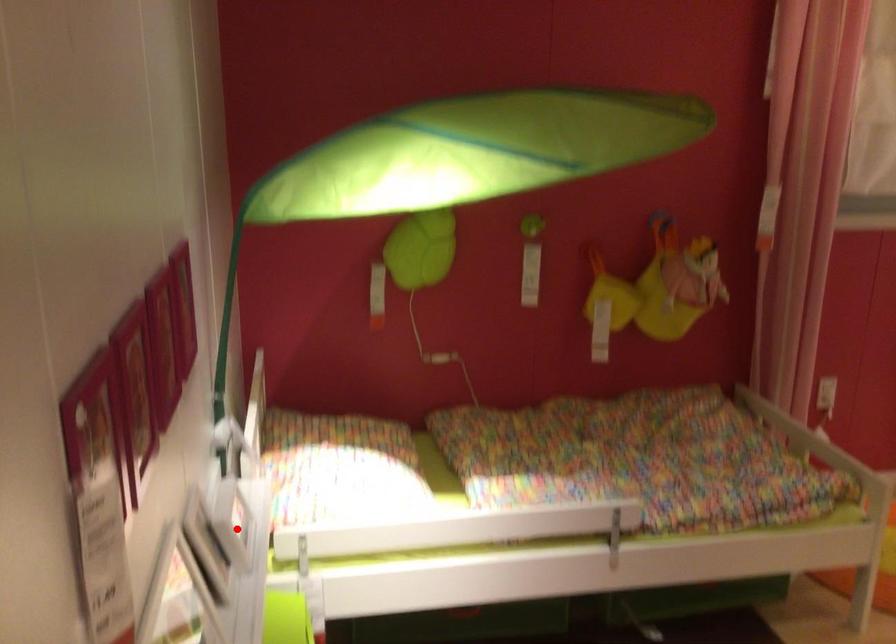
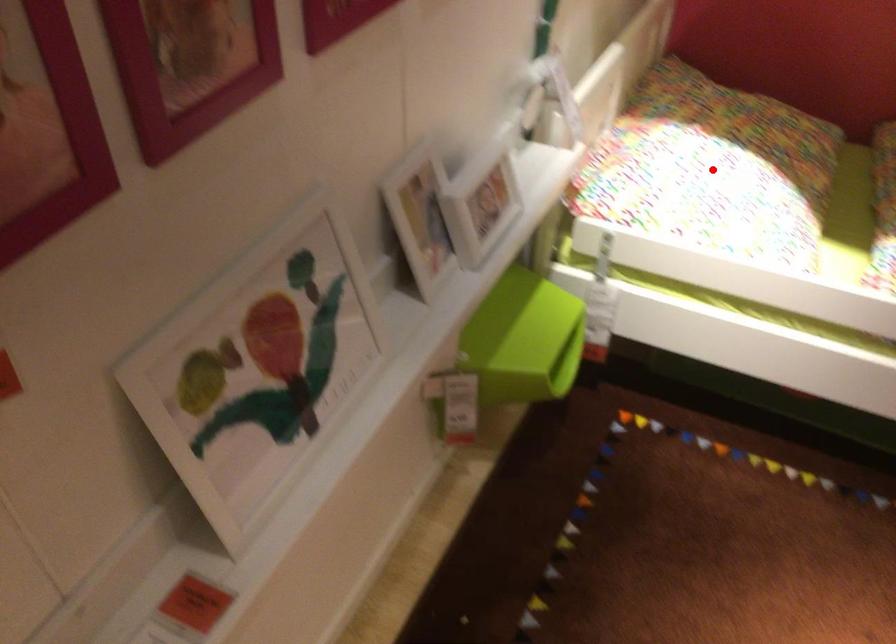
I am providing you with two images of the same scene from different viewpoints. A red point is marked on the first image and another point is marked on the second image. Do the highlighted points in image1 and image2 indicate the same real-world spot?

No